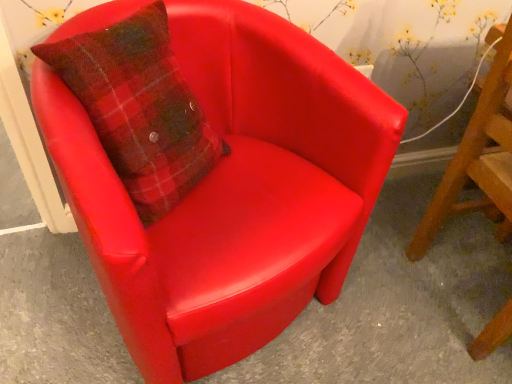
Question: From the image's perspective, would you say matte red armchair at center, which is the second chair in right-to-left order, is shown under matte red chair at center, arranged as the 1th chair when viewed from the right?

Choices:
 (A) no
 (B) yes

Answer: (A)

Question: Is the position of matte red armchair at center, which is the 1th chair in left-to-right order, more distant than that of matte red chair at center, acting as the second chair starting from the left?

Choices:
 (A) yes
 (B) no

Answer: (B)

Question: Does matte red armchair at center, which is the second chair in right-to-left order, have a greater width compared to matte red chair at center, acting as the second chair starting from the left?

Choices:
 (A) yes
 (B) no

Answer: (A)

Question: Considering the relative positions of matte red armchair at center, which is the second chair in right-to-left order, and matte red chair at center, acting as the second chair starting from the left, in the image provided, is matte red armchair at center, which is the second chair in right-to-left order, to the right of matte red chair at center, acting as the second chair starting from the left, from the viewer's perspective?

Choices:
 (A) yes
 (B) no

Answer: (B)

Question: Is matte red armchair at center, which is the second chair in right-to-left order, oriented towards matte red chair at center, arranged as the 1th chair when viewed from the right?

Choices:
 (A) no
 (B) yes

Answer: (A)

Question: Is point (140, 382) positioned closer to the camera than point (359, 122)?

Choices:
 (A) farther
 (B) closer

Answer: (A)

Question: Considering the positions of glossy leather chair at center and matte red armchair at center, which is the second chair in right-to-left order, in the image, is glossy leather chair at center bigger or smaller than matte red armchair at center, which is the second chair in right-to-left order,?

Choices:
 (A) big
 (B) small

Answer: (B)

Question: From their relative heights in the image, would you say glossy leather chair at center is taller or shorter than matte red armchair at center, which is the 1th chair in left-to-right order?

Choices:
 (A) short
 (B) tall

Answer: (A)

Question: Do you think glossy leather chair at center is within matte red armchair at center, which is the 1th chair in left-to-right order, or outside of it?

Choices:
 (A) inside
 (B) outside

Answer: (B)

Question: Visually, is matte red armchair at center, which is the 1th chair in left-to-right order, positioned to the left or to the right of matte red chair at center, acting as the second chair starting from the left?

Choices:
 (A) right
 (B) left

Answer: (B)

Question: Considering the positions of matte red armchair at center, which is the 1th chair in left-to-right order, and matte red chair at center, arranged as the 1th chair when viewed from the right, in the image, is matte red armchair at center, which is the 1th chair in left-to-right order, taller or shorter than matte red chair at center, arranged as the 1th chair when viewed from the right,?

Choices:
 (A) short
 (B) tall

Answer: (A)

Question: From the image's perspective, is matte red armchair at center, which is the 1th chair in left-to-right order, located above or below matte red chair at center, acting as the second chair starting from the left?

Choices:
 (A) below
 (B) above

Answer: (B)

Question: Is matte red armchair at center, which is the 1th chair in left-to-right order, inside or outside of matte red chair at center, acting as the second chair starting from the left?

Choices:
 (A) inside
 (B) outside

Answer: (B)

Question: Would you say glossy leather chair at center is to the left or to the right of matte red chair at center, acting as the second chair starting from the left, in the picture?

Choices:
 (A) left
 (B) right

Answer: (A)

Question: Is glossy leather chair at center spatially inside matte red chair at center, acting as the second chair starting from the left, or outside of it?

Choices:
 (A) outside
 (B) inside

Answer: (A)